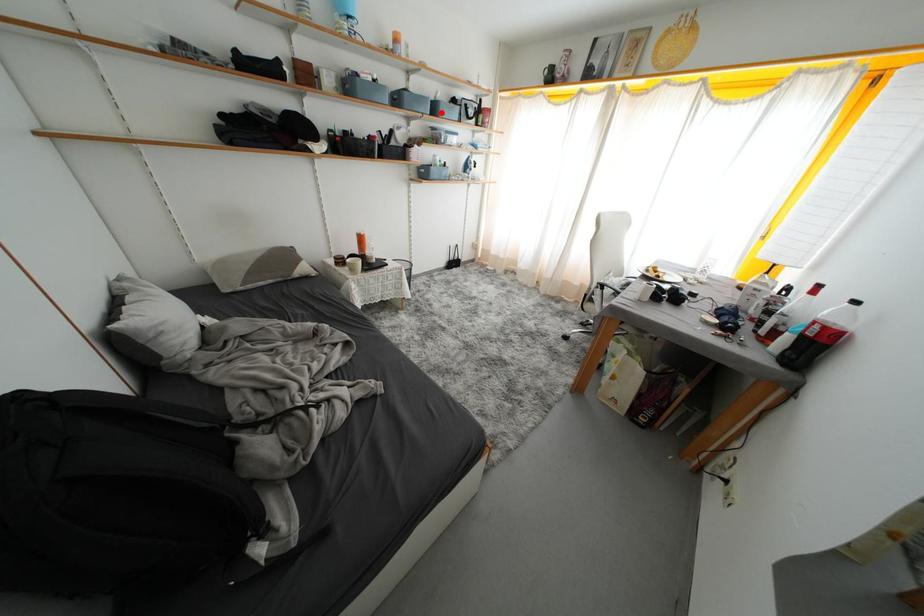
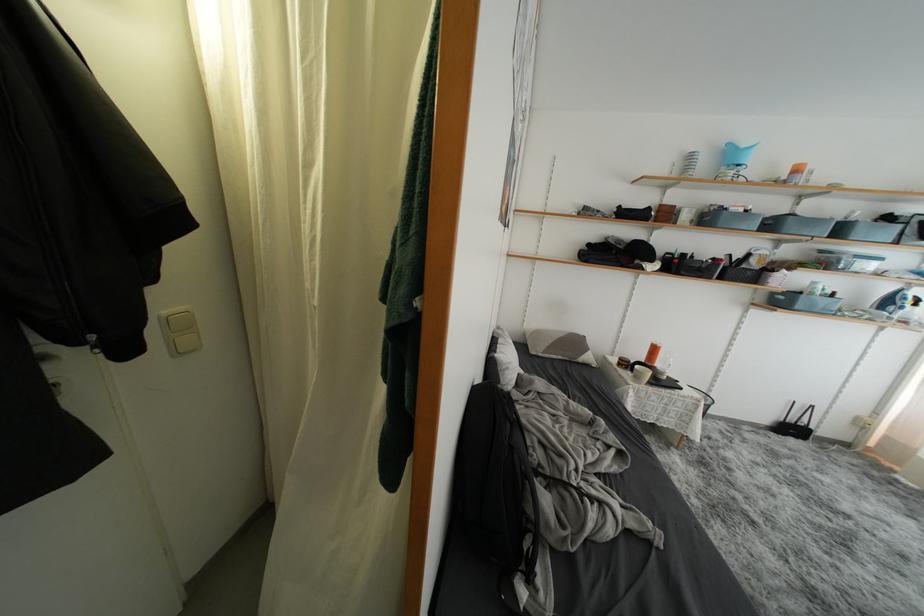
Question: I am providing you with two images of the same scene from different viewpoints. Image1 has a red point marked. In image2, the corresponding 3D location appears at what relative position? Reply with the corresponding letter.

Choices:
 (A) Closer
 (B) Farther

Answer: (B)